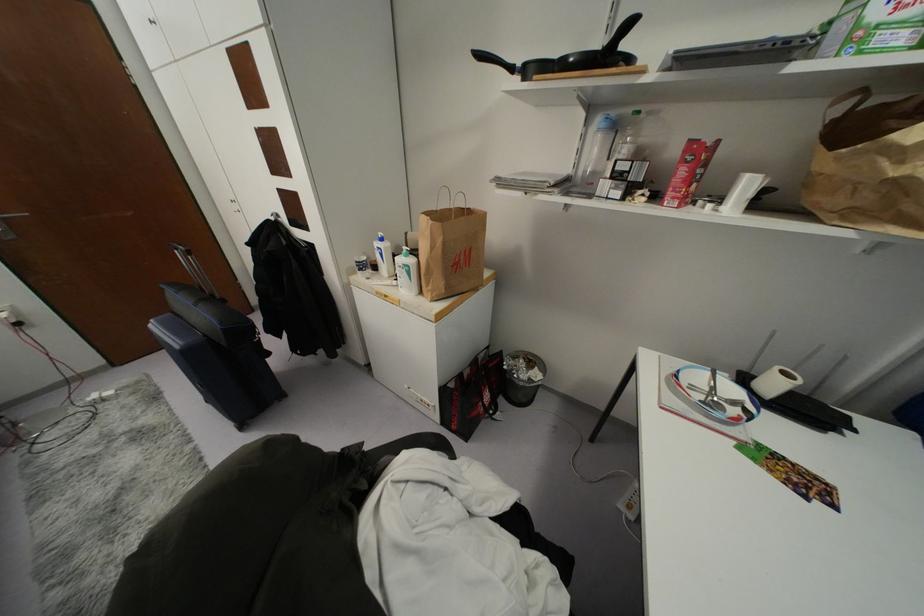
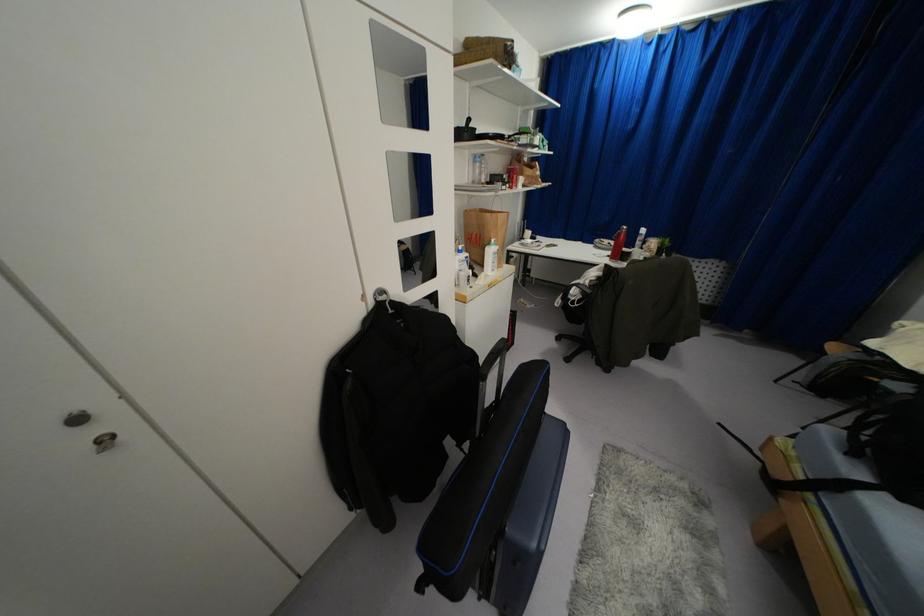
In the second image, find the point that corresponds to [599,130] in the first image.

(475, 161)